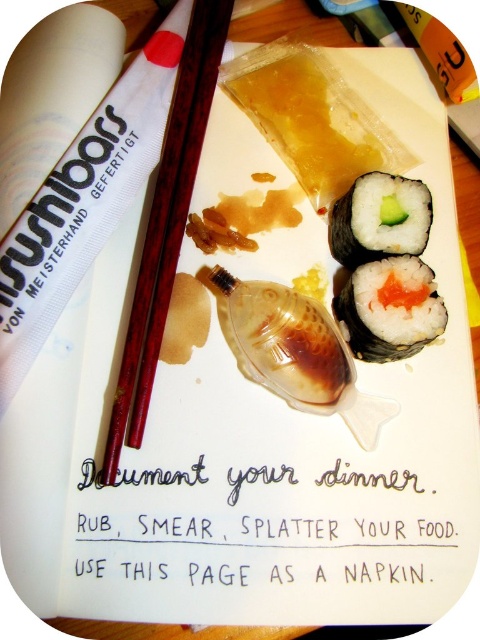
Question: Can you confirm if brown wood chopsticks at center is positioned to the right of white rice with salmon filling at center?

Choices:
 (A) no
 (B) yes

Answer: (A)

Question: Which point is closer to the camera taking this photo?

Choices:
 (A) (409, 234)
 (B) (137, 417)

Answer: (B)

Question: Which is farther from the white rice with seaweed at upper center?

Choices:
 (A) white rice with salmon filling at center
 (B) brown wood chopsticks at center

Answer: (B)

Question: Which of the following is the farthest from the observer?

Choices:
 (A) [408, 234]
 (B) [188, 99]
 (C) [422, 280]

Answer: (B)

Question: Does brown wood chopsticks at center appear on the left side of white rice with salmon filling at center?

Choices:
 (A) yes
 (B) no

Answer: (A)

Question: Can you confirm if brown wood chopsticks at center is positioned below white rice with seaweed at upper center?

Choices:
 (A) yes
 (B) no

Answer: (A)